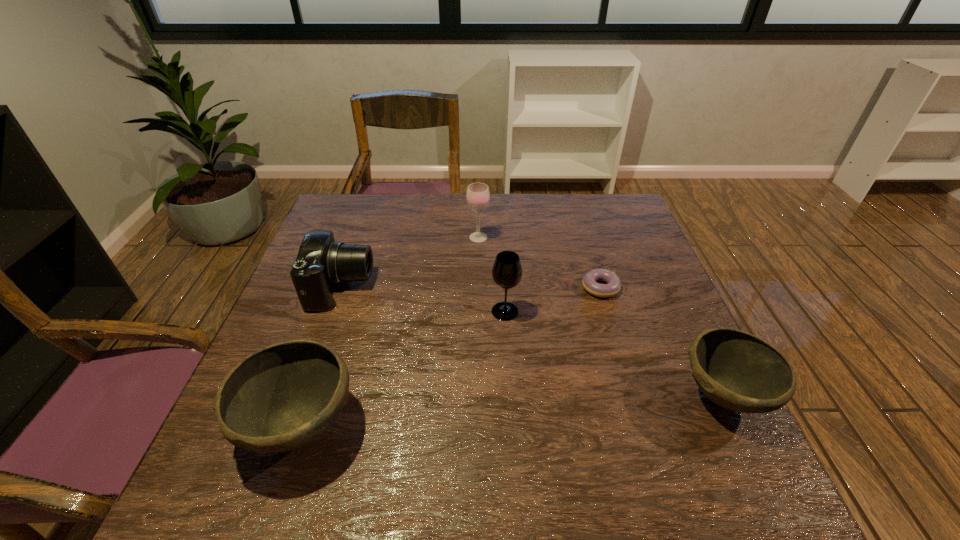
In order to click on blank area in the image that satisfies the following two spatial constraints: 1. on the lens of the taller bowl; 2. on the right side of the camera in this screenshot , I will do `click(292, 426)`.

Find the location of `vacant point that satisfies the following two spatial constraints: 1. on the lens of the camera; 2. on the left side of the shortest object`. vacant point that satisfies the following two spatial constraints: 1. on the lens of the camera; 2. on the left side of the shortest object is located at coordinates (341, 287).

Where is `vacant space that satisfies the following two spatial constraints: 1. on the front side of the nearer wineglass; 2. on the left side of the farthest object`? This screenshot has width=960, height=540. vacant space that satisfies the following two spatial constraints: 1. on the front side of the nearer wineglass; 2. on the left side of the farthest object is located at coordinates (478, 311).

Where is `blank area in the image that satisfies the following two spatial constraints: 1. on the front side of the farthest object; 2. on the lens of the camera`? This screenshot has width=960, height=540. blank area in the image that satisfies the following two spatial constraints: 1. on the front side of the farthest object; 2. on the lens of the camera is located at coordinates (478, 287).

At what (x,y) coordinates should I click in order to perform the action: click on vacant space that satisfies the following two spatial constraints: 1. on the lens of the camera; 2. on the left side of the rightmost object. Please return your answer as a coordinate pair (x, y). Looking at the image, I should click on (302, 396).